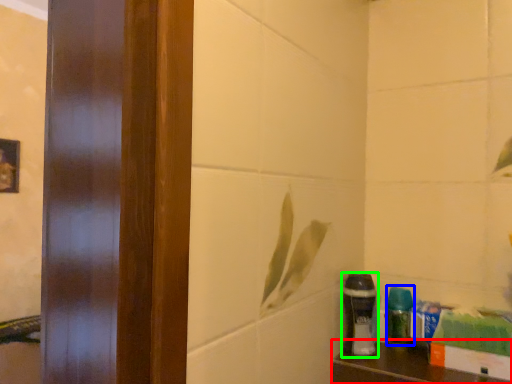
Question: Which is farther away from furniture (highlighted by a red box)? cleaning product (highlighted by a blue box) or shaving cream (highlighted by a green box)?

Choices:
 (A) cleaning product
 (B) shaving cream

Answer: (B)